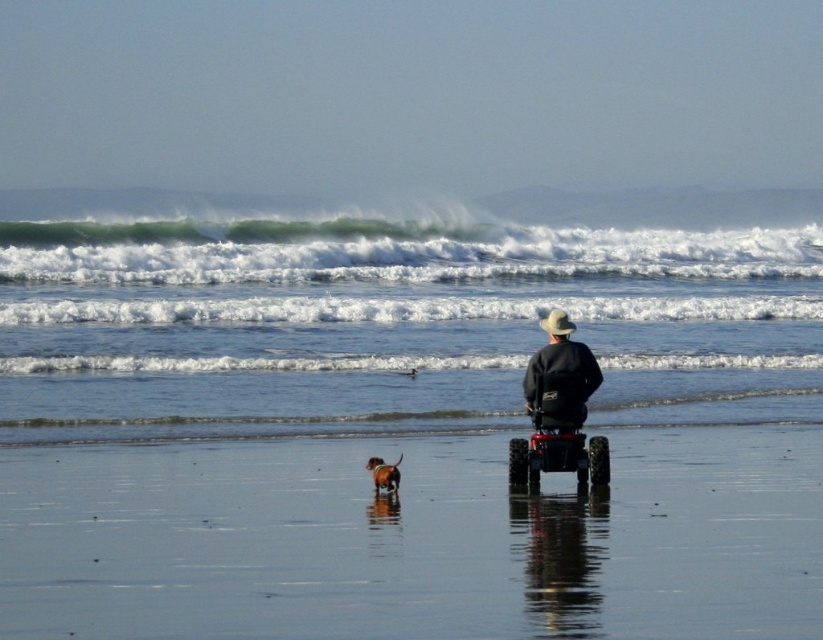
Which is in front, point (759, 616) or point (777, 260)?

Point (759, 616) is more forward.

Between point (722, 436) and point (558, 244), which one is positioned behind?

The point (558, 244) is behind.

The image size is (823, 640). Identify the location of shiny metallic beach at center. (412, 540).

Is white frothy wave at upper center bigger than black rubber wheelchair at center?

Yes, white frothy wave at upper center is bigger than black rubber wheelchair at center.

Between white frothy wave at upper center and black rubber wheelchair at center, which one is positioned lower?

black rubber wheelchair at center

Describe the element at coordinates (386, 252) in the screenshot. The image size is (823, 640). I see `white frothy wave at upper center` at that location.

Where is `white frothy wave at upper center`? white frothy wave at upper center is located at coordinates (386, 252).

Describe the element at coordinates (559, 376) in the screenshot. I see `matte black jacket at center` at that location.

Does matte black jacket at center have a lesser width compared to black rubber wheelchair at center?

Yes.

The image size is (823, 640). Describe the element at coordinates (559, 376) in the screenshot. I see `matte black jacket at center` at that location.

This screenshot has height=640, width=823. I want to click on matte black jacket at center, so click(559, 376).